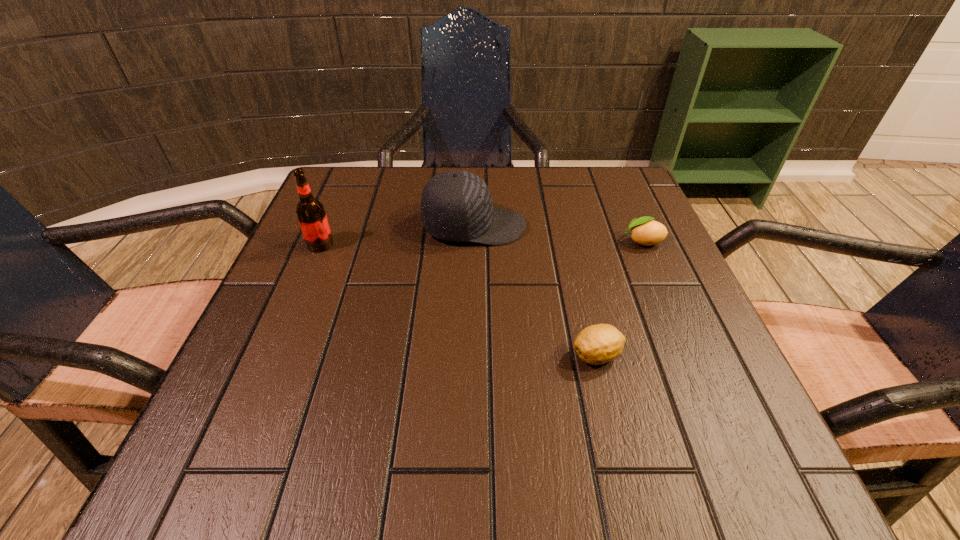
Locate an element on the screen. Image resolution: width=960 pixels, height=540 pixels. free space at the right edge is located at coordinates 636,397.

You are a GUI agent. You are given a task and a screenshot of the screen. Output one action in this format:
    pyautogui.click(x=<x>, y=<y>)
    Task: Click on the free region at the far left corner of the desktop
    The image size is (960, 540).
    Given the screenshot: What is the action you would take?
    pyautogui.click(x=379, y=207)

In order to click on vacant position at the near left corner of the desktop in this screenshot , I will do `click(281, 438)`.

Find the location of a particular element. vacant space at the far right corner of the desktop is located at coordinates (604, 176).

The image size is (960, 540). In order to click on free spot at the near right corner of the desktop in this screenshot , I will do `click(718, 444)`.

The height and width of the screenshot is (540, 960). I want to click on free space between the baseball cap and the farther lemon, so (559, 234).

Where is `unoccupied area between the root beer and the nearer lemon`? This screenshot has width=960, height=540. unoccupied area between the root beer and the nearer lemon is located at coordinates (459, 300).

Find the location of a particular element. This screenshot has width=960, height=540. empty space that is in between the root beer and the baseball cap is located at coordinates (397, 235).

Locate an element on the screen. free spot between the left lemon and the right lemon is located at coordinates (619, 299).

Where is `empty location between the tallest object and the nearest object`? empty location between the tallest object and the nearest object is located at coordinates (459, 300).